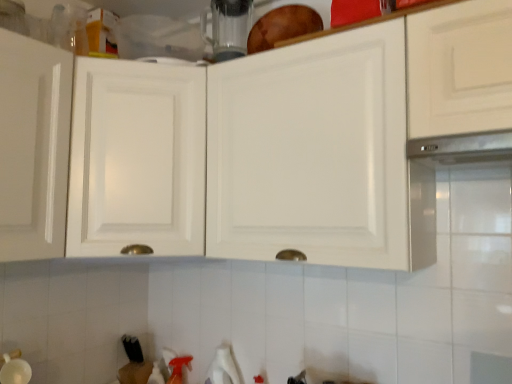
Question: From their relative heights in the image, would you say transparent glass blender at upper center is taller or shorter than white glossy cabinet at upper center, the second cabinetry viewed from the right?

Choices:
 (A) short
 (B) tall

Answer: (A)

Question: From a real-world perspective, is transparent glass blender at upper center above or below white glossy cabinet at upper center, the second cabinetry viewed from the right?

Choices:
 (A) below
 (B) above

Answer: (B)

Question: Estimate the real-world distances between objects in this image. Which object is closer to the transparent glass blender at upper center?

Choices:
 (A) satin metallic exhaust hood at upper right
 (B) white glossy cabinet at upper center, the first cabinetry from the left
 (C) white glossy cabinet at upper center, placed as the first cabinetry when sorted from right to left

Answer: (B)

Question: Estimate the real-world distances between objects in this image. Which object is farther from the white glossy cabinet at upper center, placed as the first cabinetry when sorted from right to left?

Choices:
 (A) satin metallic exhaust hood at upper right
 (B) transparent glass blender at upper center
 (C) white glossy cabinet at upper center, the second cabinetry viewed from the right

Answer: (B)